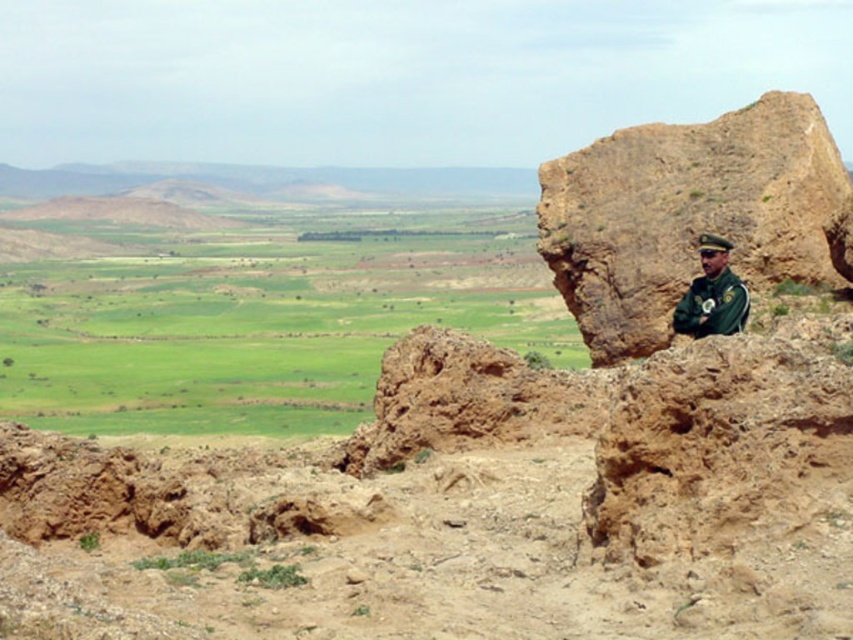
Question: Can you confirm if brown rough rock at right is bigger than green uniform at right?

Choices:
 (A) yes
 (B) no

Answer: (A)

Question: Does green grassland at center have a lesser width compared to brown rough rock at right?

Choices:
 (A) yes
 (B) no

Answer: (B)

Question: Which point appears farthest from the camera in this image?

Choices:
 (A) (721, 260)
 (B) (831, 193)

Answer: (B)

Question: Among these points, which one is nearest to the camera?

Choices:
 (A) (711, 291)
 (B) (94, 289)

Answer: (A)

Question: Is green grassland at center below green uniform at right?

Choices:
 (A) yes
 (B) no

Answer: (B)

Question: Which point is closer to the camera taking this photo?

Choices:
 (A) (613, 173)
 (B) (720, 324)
 (C) (297, 237)

Answer: (B)